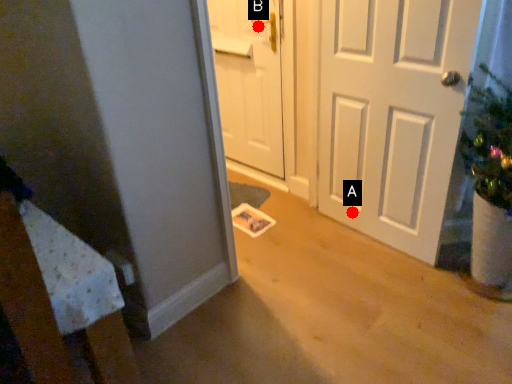
Question: Two points are circled on the image, labeled by A and B beside each circle. Which point is farther to the camera?

Choices:
 (A) A is further
 (B) B is further

Answer: (B)